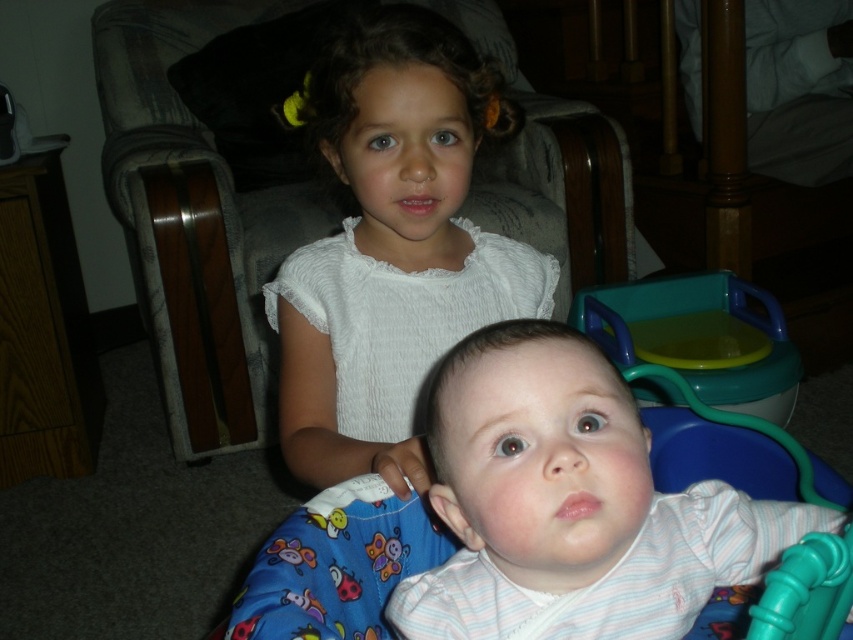
You are a parent standing in the room and want to hand a toy to the child wearing the white striped shirt at center. Can you reach them without moving closer?

The white striped shirt at center is 18.83 inches away from the viewer, so yes, you can reach them without moving closer.

You are a photographer trying to capture a photo of the two children. The white striped shirt at center and the white lace dress at upper center are in your viewfinder. Which child should you focus on first if you want to ensure both are in focus?

You should focus on the white lace dress at upper center first because it is taller than the white striped shirt at center, ensuring both will be in focus.

You are a photographer trying to capture a closeup of the white lace dress at upper center. Given that your camera has a minimum focusing distance of 24 inches, will you be able to take the photo without moving closer?

The distance between the white lace dress at upper center and the camera is 27.38 inches, which is greater than the camera minimum focusing distance of 24 inches. Therefore, you can take the photo without moving closer.